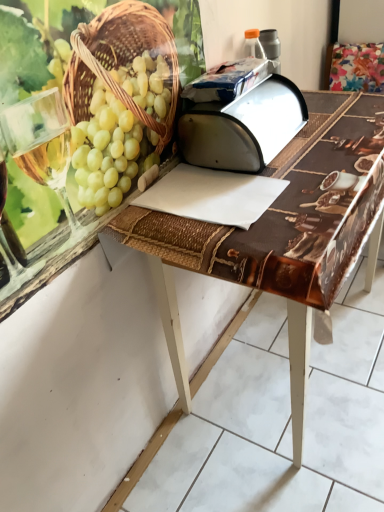
Locate an element on the screen. Image resolution: width=384 pixels, height=512 pixels. vacant space underneath brown woven table at center (from a real-world perspective) is located at coordinates (275, 364).